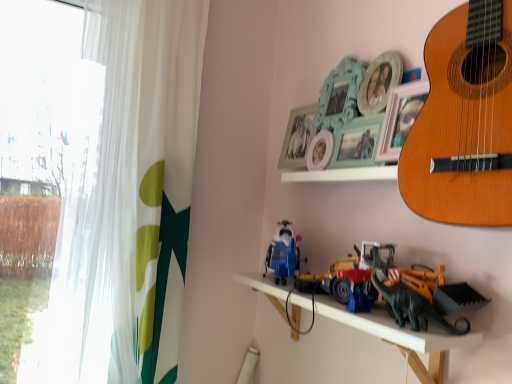
Question: Is green matte dinosaur at lower right, which ranks as the second toy in left-to-right order, surrounding white wooden shelf at upper center?

Choices:
 (A) no
 (B) yes

Answer: (A)

Question: Considering the relative sizes of green matte dinosaur at lower right, which is the second toy from right to left, and white wooden shelf at upper center in the image provided, is green matte dinosaur at lower right, which is the second toy from right to left, taller than white wooden shelf at upper center?

Choices:
 (A) no
 (B) yes

Answer: (B)

Question: Is green matte dinosaur at lower right, which ranks as the second toy in left-to-right order, not close to white wooden shelf at upper center?

Choices:
 (A) yes
 (B) no

Answer: (B)

Question: Does green matte dinosaur at lower right, which is the second toy from right to left, lie behind white wooden shelf at upper center?

Choices:
 (A) yes
 (B) no

Answer: (B)

Question: Is green matte dinosaur at lower right, which is the second toy from right to left, not within white wooden shelf at upper center?

Choices:
 (A) yes
 (B) no

Answer: (A)

Question: Is green matte dinosaur at lower right, which ranks as the second toy in left-to-right order, beside white wooden shelf at upper center?

Choices:
 (A) yes
 (B) no

Answer: (B)

Question: From the image's perspective, is light brown wooden guitar at upper right on top of white sheer curtain at left?

Choices:
 (A) yes
 (B) no

Answer: (A)

Question: From a real-world perspective, is light brown wooden guitar at upper right located higher than white sheer curtain at left?

Choices:
 (A) no
 (B) yes

Answer: (B)

Question: From the image's perspective, is light brown wooden guitar at upper right below white sheer curtain at left?

Choices:
 (A) yes
 (B) no

Answer: (B)

Question: Does light brown wooden guitar at upper right have a greater width compared to white sheer curtain at left?

Choices:
 (A) yes
 (B) no

Answer: (A)

Question: Is light brown wooden guitar at upper right facing away from white sheer curtain at left?

Choices:
 (A) no
 (B) yes

Answer: (A)

Question: Could you tell me if light brown wooden guitar at upper right is facing white sheer curtain at left?

Choices:
 (A) no
 (B) yes

Answer: (A)

Question: From the image's perspective, is white sheer curtain at left located beneath light brown wooden guitar at upper right?

Choices:
 (A) no
 (B) yes

Answer: (B)